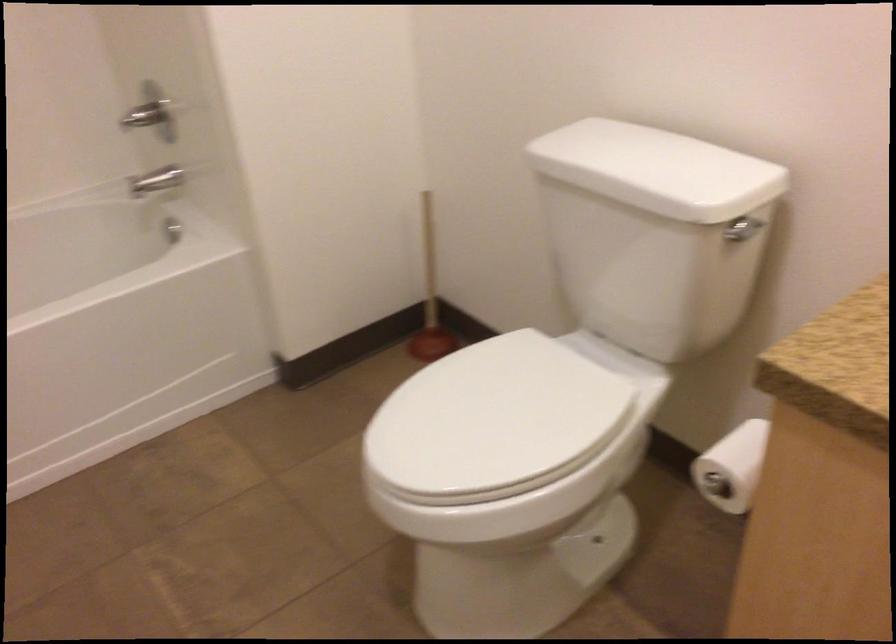
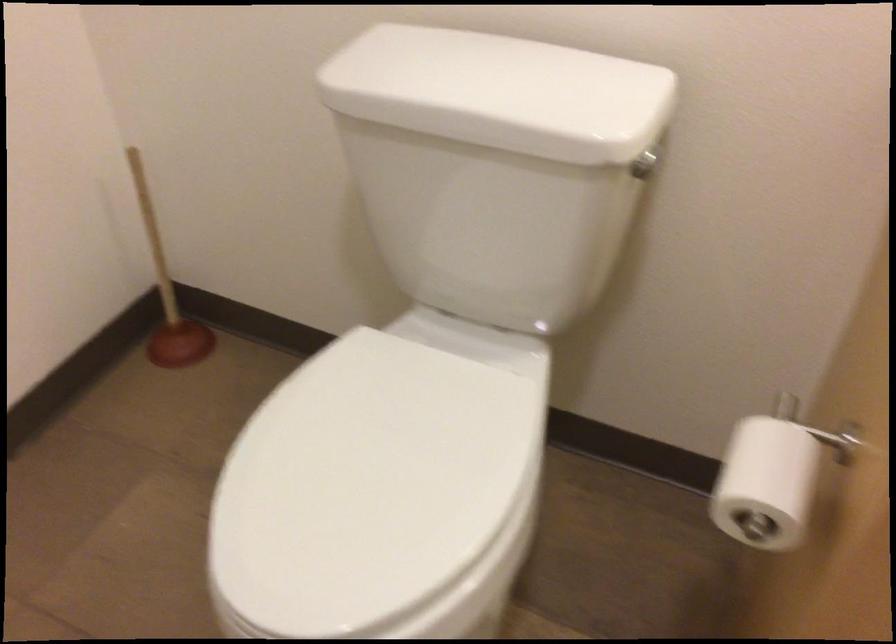
In the second image, find the point that corresponds to point (488, 431) in the first image.

(376, 496)